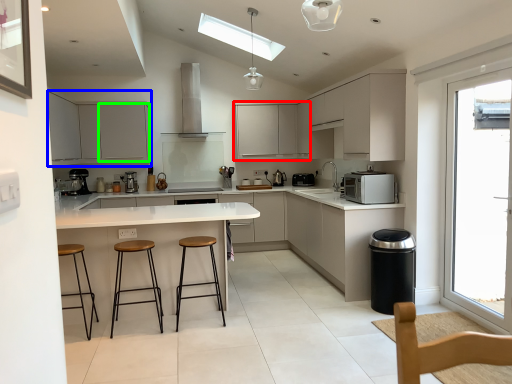
Question: Estimate the real-world distances between objects in this image. Which object is farther from cabinetry (highlighted by a red box), cabinetry (highlighted by a blue box) or cabinetry (highlighted by a green box)?

Choices:
 (A) cabinetry
 (B) cabinetry

Answer: (A)